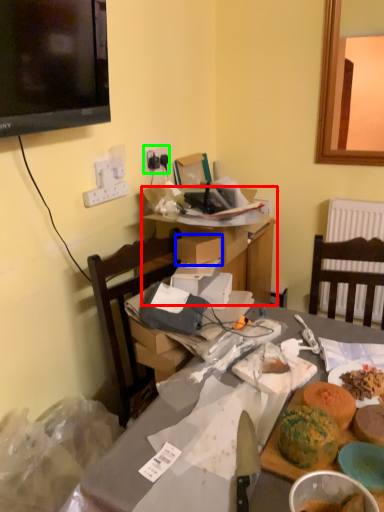
Question: Based on their relative distances, which object is nearer to table (highlighted by a red box)? Choose from box (highlighted by a blue box) and electric outlet (highlighted by a green box).

Choices:
 (A) box
 (B) electric outlet

Answer: (A)